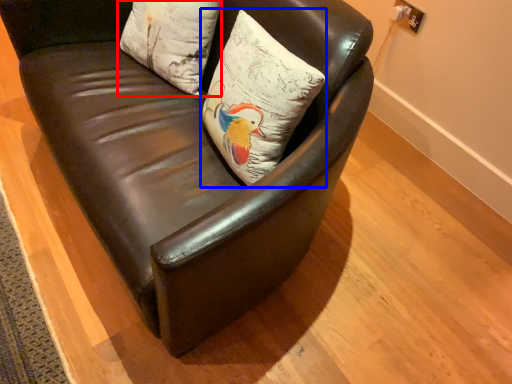
Question: Which of the following is the closest to the observer, pillow (highlighted by a red box) or pillow (highlighted by a blue box)?

Choices:
 (A) pillow
 (B) pillow

Answer: (B)